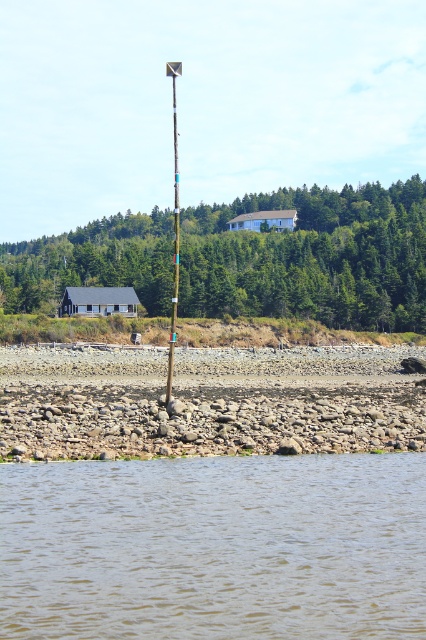
You are a hiker standing at the base of the metallic silver pole at center, looking towards the green textured tree at upper center. Which direction should you walk to reach the tree?

The green textured tree at upper center is positioned to the right of the metallic silver pole at center, so you should walk to the right to reach the tree.

You are standing at the edge of the coastal landscape and want to take a photo that includes both the brown water at lower center and the green textured tree at upper center. Based on their positions, which object should you focus on first to ensure both are in clear view?

The brown water at lower center is closer to the viewer than the green textured tree at upper center, so you should focus on the brown water at lower center first to ensure both are in clear view.